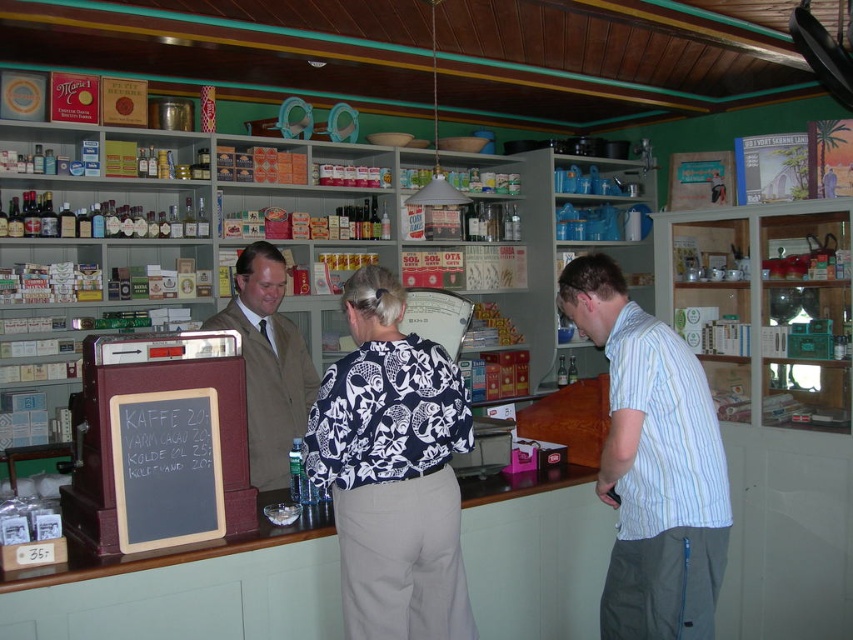
Between point (608, 584) and point (228, 328), which one is positioned behind?

The point (228, 328) is more distant.

Does point (691, 436) come farther from viewer compared to point (259, 490)?

No.

Is point (654, 365) less distant than point (277, 468)?

Yes, it is in front of point (277, 468).

Find the location of a particular element. The width and height of the screenshot is (853, 640). striped cotton shirt at center is located at coordinates (653, 465).

Which is below, white floral blouse at center or striped cotton shirt at center?

striped cotton shirt at center

Based on the photo, can you confirm if white floral blouse at center is bigger than striped cotton shirt at center?

Incorrect, white floral blouse at center is not larger than striped cotton shirt at center.

Which is in front, point (654, 563) or point (625, 449)?

Point (654, 563) is more forward.

Identify the location of white floral blouse at center. (653, 465).

Does point (450, 605) lie in front of point (650, 602)?

No, (450, 605) is behind (650, 602).

Is point (416, 480) more distant than point (643, 529)?

That is False.

The height and width of the screenshot is (640, 853). I want to click on floral print blouse at center, so click(x=392, y=470).